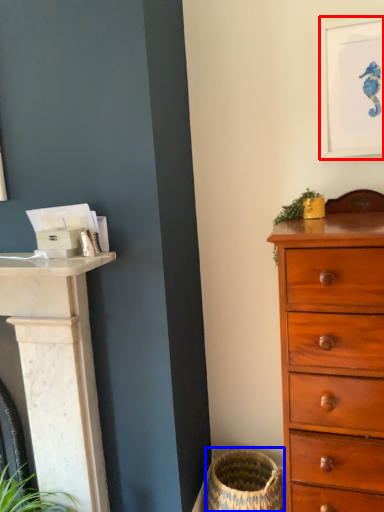
Question: Which object appears farthest to the camera in this image, picture frame (highlighted by a red box) or basket container (highlighted by a blue box)?

Choices:
 (A) picture frame
 (B) basket container

Answer: (B)